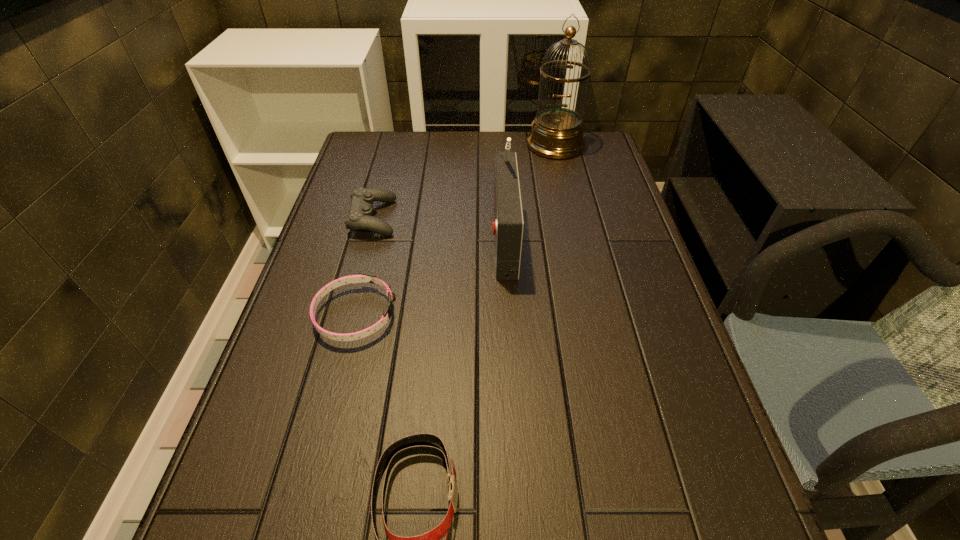
This screenshot has width=960, height=540. In order to click on the rightmost object in this screenshot , I will do `click(557, 133)`.

The height and width of the screenshot is (540, 960). In order to click on the farthest object in this screenshot , I will do pos(557,133).

Identify the location of radio receiver. This screenshot has height=540, width=960. (508, 223).

This screenshot has height=540, width=960. What are the coordinates of `the second object from right to left` in the screenshot? It's located at (508, 223).

Where is `control`? The height and width of the screenshot is (540, 960). control is located at coordinates (360, 217).

Find the location of a particular element. This screenshot has height=540, width=960. the left dog collar is located at coordinates (363, 277).

This screenshot has width=960, height=540. In order to click on the shortest object in this screenshot , I will do `click(363, 277)`.

Identify the location of free spot located with an open door on the tallest object. (578, 241).

The width and height of the screenshot is (960, 540). Identify the location of vacant space located on the front panel of the second tallest object. (419, 236).

Where is `vacant space located 0.080m on the front panel of the second tallest object`? Image resolution: width=960 pixels, height=540 pixels. vacant space located 0.080m on the front panel of the second tallest object is located at coordinates (461, 236).